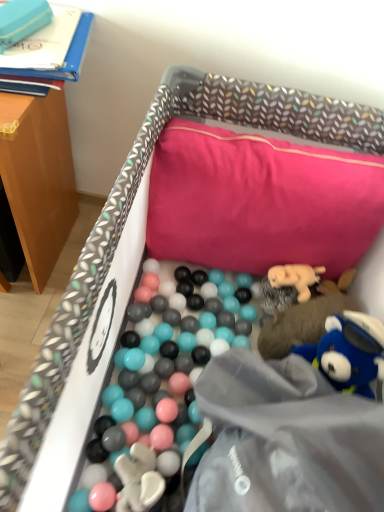
Question: From a real-world perspective, does soft plush bear at upper right, arranged as the third toy when viewed from the left, stand above soft beige plush bear at center-right, which is counted as the second toy, starting from the left?

Choices:
 (A) no
 (B) yes

Answer: (A)

Question: From the image's perspective, is soft plush bear at upper right, arranged as the 2th toy when viewed from the right, beneath soft beige plush bear at center-right, the 3th toy ordered from the bottom?

Choices:
 (A) yes
 (B) no

Answer: (A)

Question: From a real-world perspective, is soft plush bear at upper right, arranged as the third toy when viewed from the left, under soft beige plush bear at center-right, which is counted as the second toy, starting from the left?

Choices:
 (A) yes
 (B) no

Answer: (A)

Question: Is soft plush bear at upper right, the third toy viewed from the top, in front of soft beige plush bear at center-right, arranged as the 3th toy when viewed from the right?

Choices:
 (A) yes
 (B) no

Answer: (A)

Question: Is soft plush bear at upper right, arranged as the 2th toy when viewed from the right, positioned behind soft beige plush bear at center-right, arranged as the 3th toy when viewed from the right?

Choices:
 (A) yes
 (B) no

Answer: (B)

Question: From the image's perspective, relative to blue plush toy at lower right, the fourth toy viewed from the left, is soft beige plush bear at center-right, arranged as the 3th toy when viewed from the right, above or below?

Choices:
 (A) below
 (B) above

Answer: (B)

Question: In the image, is soft beige plush bear at center-right, which is counted as the second toy, starting from the left, positioned in front of or behind blue plush toy at lower right, arranged as the first toy when viewed from the right?

Choices:
 (A) front
 (B) behind

Answer: (B)

Question: Do you think soft beige plush bear at center-right, arranged as the 3th toy when viewed from the right, is within blue plush toy at lower right, the fourth toy viewed from the left, or outside of it?

Choices:
 (A) outside
 (B) inside

Answer: (A)

Question: From a real-world perspective, relative to blue plush toy at lower right, the 4th toy viewed from the top, is soft beige plush bear at center-right, which is counted as the second toy, starting from the left, vertically above or below?

Choices:
 (A) below
 (B) above

Answer: (A)

Question: In terms of width, does pink fabric pillow at upper center look wider or thinner when compared to blue plush toy at lower right, arranged as the first toy when viewed from the right?

Choices:
 (A) wide
 (B) thin

Answer: (A)

Question: Is pink fabric pillow at upper center taller or shorter than blue plush toy at lower right, the 4th toy viewed from the top?

Choices:
 (A) short
 (B) tall

Answer: (B)

Question: Is pink fabric pillow at upper center inside the boundaries of blue plush toy at lower right, arranged as the first toy when viewed from the right, or outside?

Choices:
 (A) outside
 (B) inside

Answer: (A)

Question: From the image's perspective, is pink fabric pillow at upper center located above or below blue plush toy at lower right, the fourth toy viewed from the left?

Choices:
 (A) above
 (B) below

Answer: (A)

Question: Considering the positions of matte blue box at upper left, the 4th toy from the right, and soft plush bear at upper right, the 2th toy from the bottom, in the image, is matte blue box at upper left, the 4th toy from the right, wider or thinner than soft plush bear at upper right, the 2th toy from the bottom,?

Choices:
 (A) thin
 (B) wide

Answer: (A)

Question: From the image's perspective, is matte blue box at upper left, which is counted as the 1th toy, starting from the left, located above or below soft plush bear at upper right, arranged as the 2th toy when viewed from the right?

Choices:
 (A) below
 (B) above

Answer: (B)